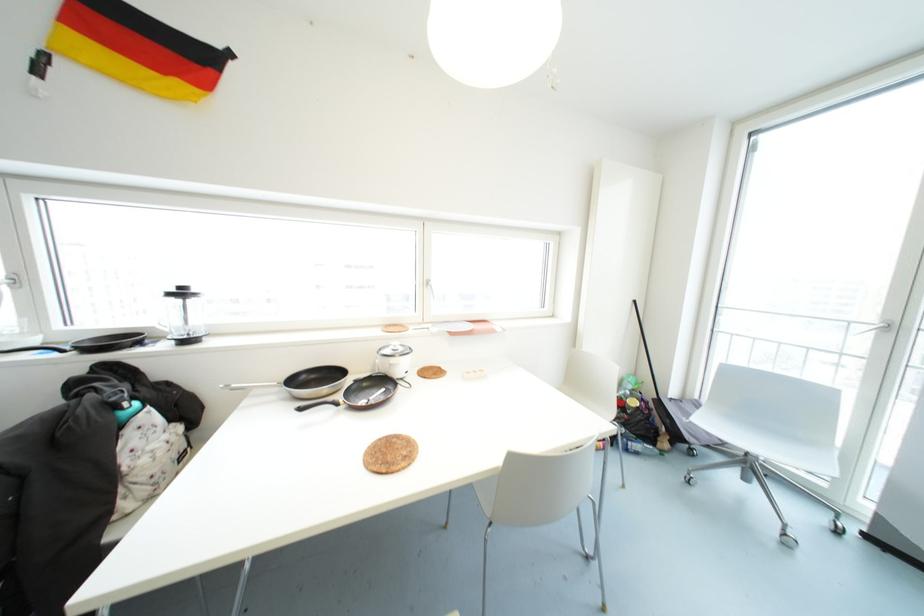
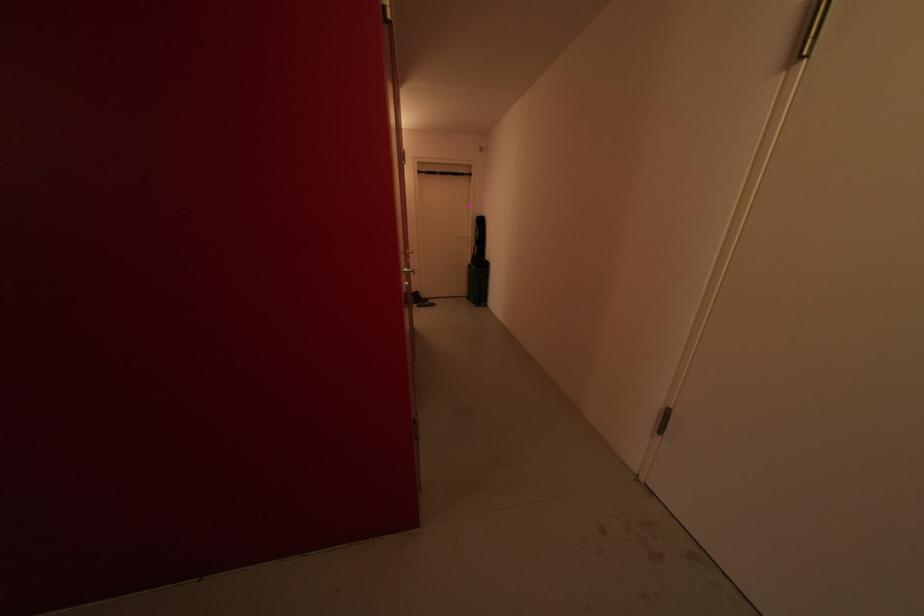
Question: I am providing you with two images of the same scene from different viewpoints. After the viewpoint changes to image2, which objects are now occluded?

Choices:
 (A) green carrying case
 (B) red thermos
 (C) metal door handle
 (D) chair sitting surface

Answer: (D)